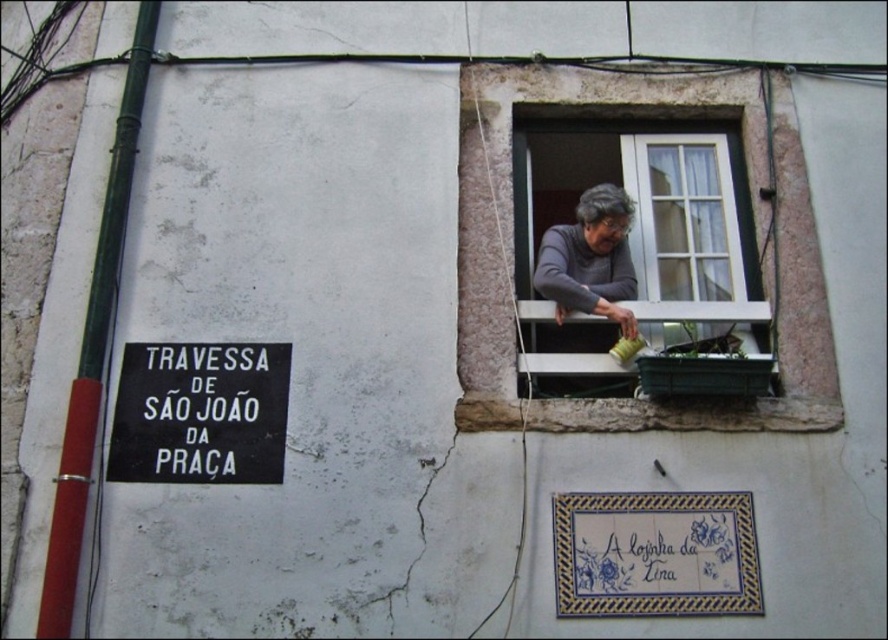
Question: Which of the following is the farthest from the observer?

Choices:
 (A) (623, 317)
 (B) (702, 240)

Answer: (B)

Question: Is white wooden window at upper right wider than black matte sign at lower left?

Choices:
 (A) yes
 (B) no

Answer: (A)

Question: Which object appears farthest from the camera in this image?

Choices:
 (A) black matte sign at lower left
 (B) white wooden window at upper right
 (C) gray fabric at window

Answer: (B)

Question: Where is white wooden window at upper right located in relation to gray fabric at window in the image?

Choices:
 (A) left
 (B) right

Answer: (B)

Question: From the image, what is the correct spatial relationship of white wooden window at upper right in relation to gray fabric at window?

Choices:
 (A) right
 (B) left

Answer: (A)

Question: Based on their relative distances, which object is nearer to the white wooden window at upper right?

Choices:
 (A) black matte sign at lower left
 (B) gray fabric at window

Answer: (B)